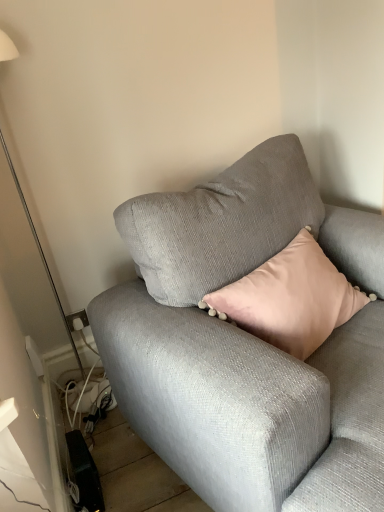
Question: Is textured gray couch at center situated inside white glossy floor lamp at left or outside?

Choices:
 (A) inside
 (B) outside

Answer: (B)

Question: Would you say textured gray couch at center is to the left or to the right of white glossy floor lamp at left in the picture?

Choices:
 (A) right
 (B) left

Answer: (A)

Question: Considering their positions, is textured gray couch at center located in front of or behind white glossy floor lamp at left?

Choices:
 (A) behind
 (B) front

Answer: (B)

Question: Is white glossy floor lamp at left taller or shorter than textured gray couch at center?

Choices:
 (A) short
 (B) tall

Answer: (B)

Question: Is white glossy floor lamp at left inside the boundaries of textured gray couch at center, or outside?

Choices:
 (A) inside
 (B) outside

Answer: (B)

Question: Is white glossy floor lamp at left in front of or behind textured gray couch at center in the image?

Choices:
 (A) front
 (B) behind

Answer: (B)

Question: Is white glossy floor lamp at left to the left or to the right of textured gray couch at center in the image?

Choices:
 (A) left
 (B) right

Answer: (A)